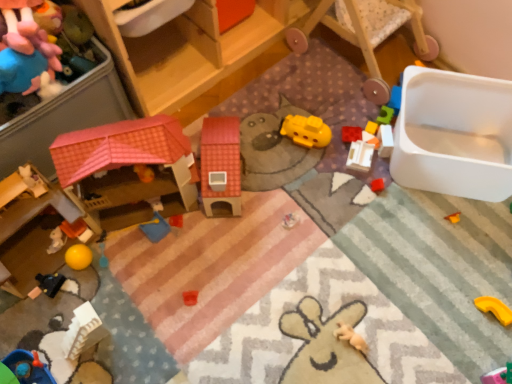
This screenshot has height=384, width=512. I want to click on free space to the left of rubber brick at upper right, placed as the 7th toy when sorted from left to right, so click(298, 145).